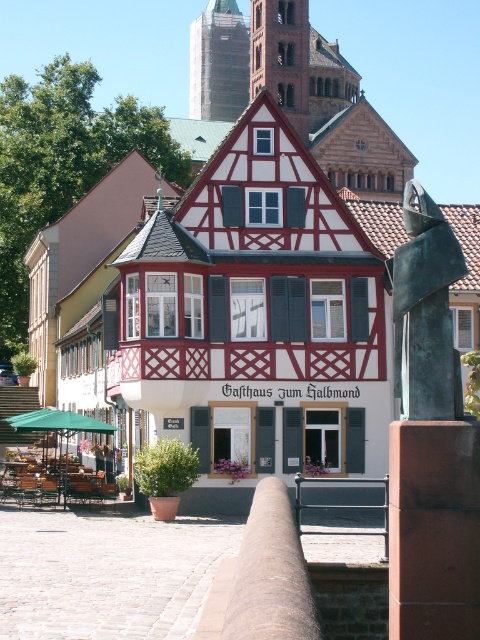
Between bronze sculpture at right and metallic gray rail at center, which one appears on the left side from the viewer's perspective?

metallic gray rail at center is more to the left.

What do you see at coordinates (425, 310) in the screenshot? This screenshot has height=640, width=480. I see `bronze sculpture at right` at bounding box center [425, 310].

Image resolution: width=480 pixels, height=640 pixels. Find the location of `bronze sculpture at right`. bronze sculpture at right is located at coordinates tap(425, 310).

Can you confirm if bronze sculpture at right is thinner than red brick tower at upper center?

Yes.

Does point (407, 260) come farther from viewer compared to point (279, 77)?

No, (407, 260) is in front of (279, 77).

Is point (407, 372) in front of point (255, 90)?

Yes, it is in front of point (255, 90).

At what (x,y) coordinates should I click in order to perform the action: click on bronze sculpture at right. Please return your answer as a coordinate pair (x, y). Looking at the image, I should click on (425, 310).

Can you confirm if bronze sculpture at right is shorter than brown stone tower at upper center?

Correct, bronze sculpture at right is not as tall as brown stone tower at upper center.

Where is `bronze sculpture at right`? Image resolution: width=480 pixels, height=640 pixels. bronze sculpture at right is located at coordinates (425, 310).

Is point (404, 282) closer to camera compared to point (210, 72)?

That is True.

At what (x,y) coordinates should I click in order to perform the action: click on bronze sculpture at right. Please return your answer as a coordinate pair (x, y). Looking at the image, I should click on (425, 310).